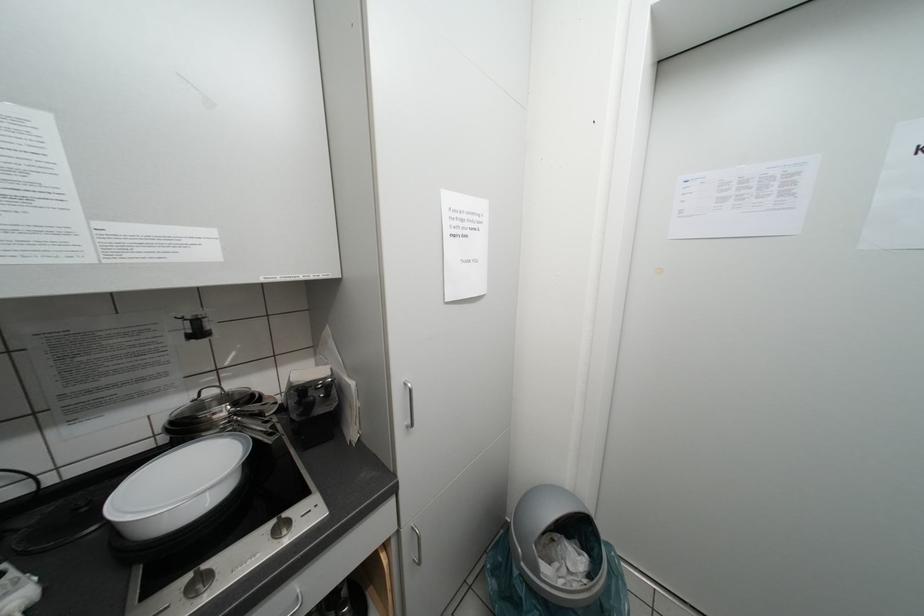
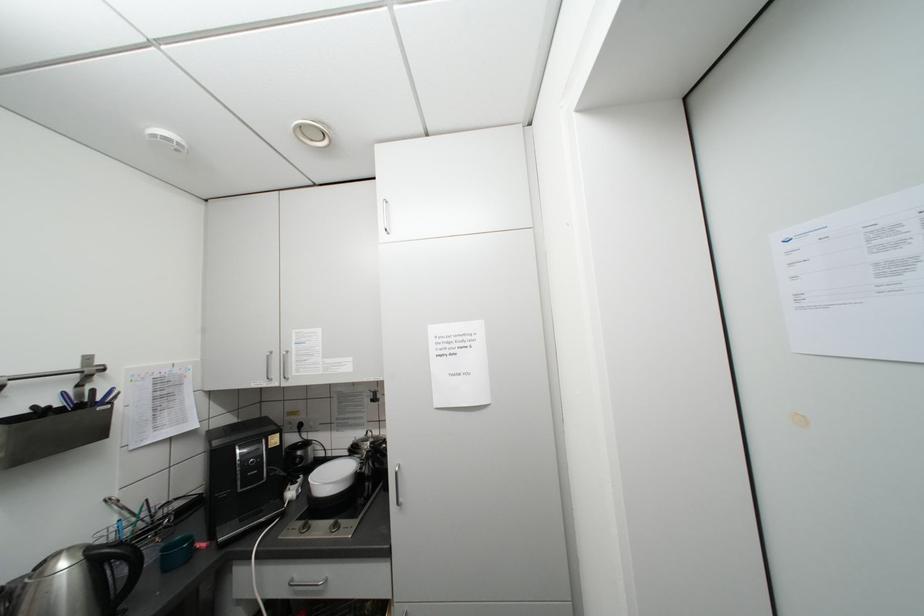
Question: The first image is from the beginning of the video and the second image is from the end. How did the camera likely rotate when shooting the video?

Choices:
 (A) Left
 (B) Right
 (C) Up
 (D) Down

Answer: (A)